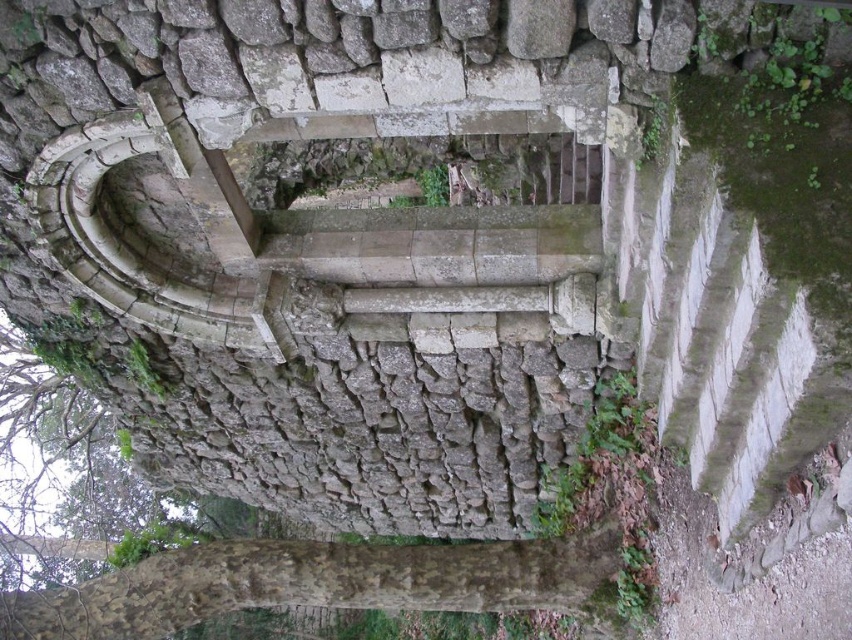
You are an archaeologist examining the ancient stone structure. You notice two objects at the lower left corner of the image. One is labeled as brown rough bark at lower left and the other as brown rough bark tree at lower left. Based on their sizes, which one is more likely to be part of the original structure and why?

The brown rough bark at lower left is larger in size than the brown rough bark tree at lower left. Since the original structure is made of large, irregular stones, the larger brown rough bark at lower left is more likely to be part of the original structure because its size matches the stonework described in the scene.

You are standing in front of the ancient stone structure and notice two objects at the lower left corner of the image. One is labeled as brown rough bark at lower left and the other as brown rough bark tree at lower left. Which of these two objects is closer to you?

The brown rough bark at lower left is closer to you because it is positioned in front of the brown rough bark tree at lower left.